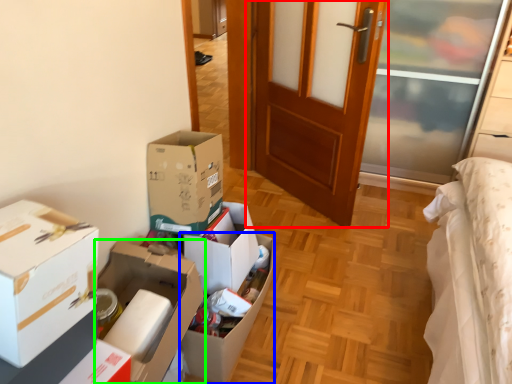
Question: Estimate the real-world distances between objects in this image. Which object is closer to door (highlighted by a red box), box (highlighted by a blue box) or box (highlighted by a green box)?

Choices:
 (A) box
 (B) box

Answer: (A)